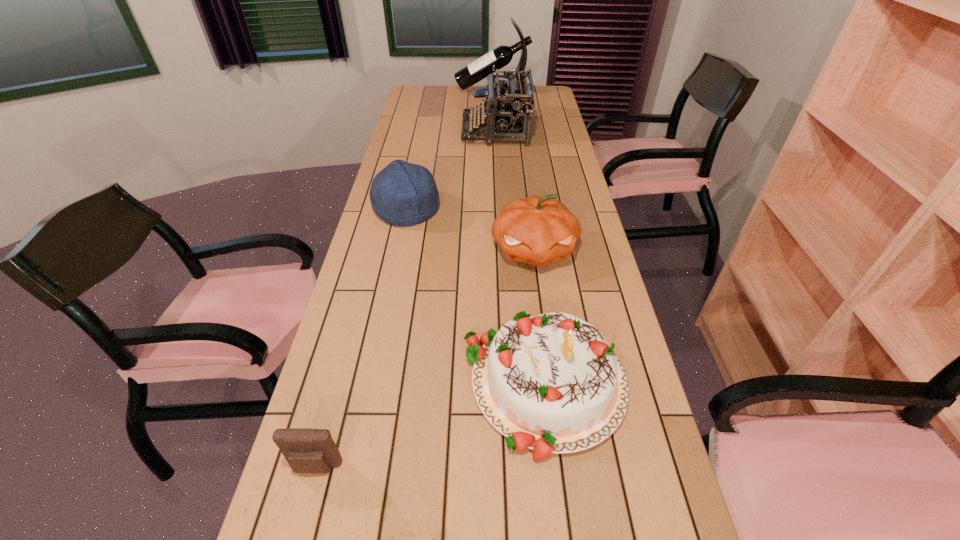
I want to click on typewriter that is at the right edge, so click(510, 114).

Image resolution: width=960 pixels, height=540 pixels. I want to click on pumpkin positioned at the right edge, so click(x=536, y=230).

Where is `cake that is positioned at the right edge`? This screenshot has width=960, height=540. cake that is positioned at the right edge is located at coordinates point(551,383).

Locate an element on the screen. The height and width of the screenshot is (540, 960). object that is at the far right corner is located at coordinates (501, 56).

This screenshot has height=540, width=960. Identify the location of vacant area at the far edge. (444, 89).

You are a GUI agent. You are given a task and a screenshot of the screen. Output one action in this format:
    pyautogui.click(x=<x>, y=<y>)
    Task: Click on the vacant region at the left edge of the desktop
    This screenshot has width=960, height=540.
    Given the screenshot: What is the action you would take?
    pyautogui.click(x=337, y=369)

Where is `free space between the typewriter and the skullcap`? Image resolution: width=960 pixels, height=540 pixels. free space between the typewriter and the skullcap is located at coordinates (451, 170).

Find the location of a particular element. Image resolution: width=960 pixels, height=540 pixels. free space between the pouch and the farthest object is located at coordinates (404, 281).

In order to click on free space between the pumpkin and the shortest object in this screenshot , I will do pyautogui.click(x=425, y=359).

Image resolution: width=960 pixels, height=540 pixels. What are the coordinates of `vacant point located between the pumpkin and the pouch` in the screenshot? It's located at (425, 359).